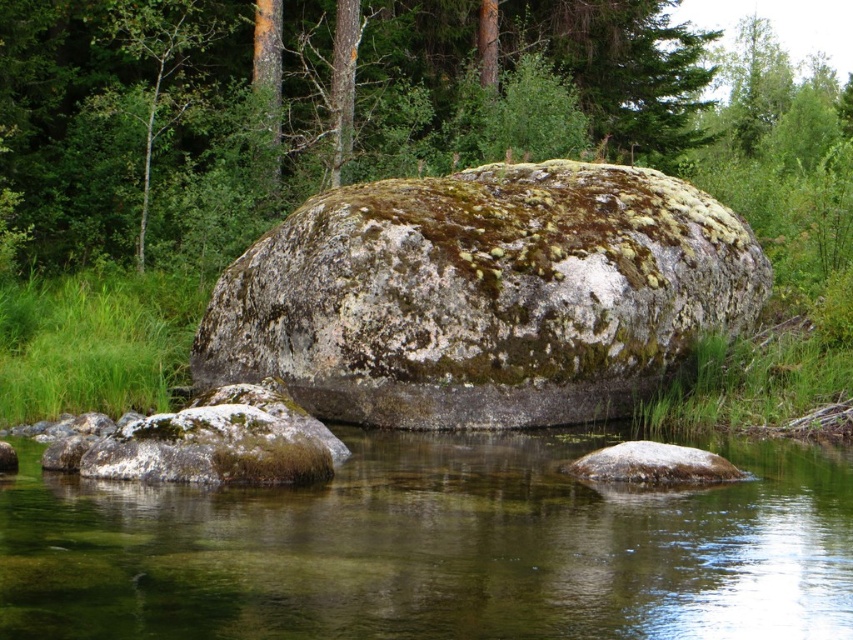
Based on the photo, you are standing at the edge of the water and see the clear water at center and the smooth gray rock at center. Which one is lower in height?

The clear water at center has a lesser height compared to the smooth gray rock at center, so the clear water at center is lower in height.

Based on the photo, you are standing at the edge of the water and see the clear water at center and the green mossy rock at center. Which object is directly above the other?

The green mossy rock at center is directly above the clear water at center because the clear water at center is positioned under it.

You are standing at the edge of the water and want to place a small statue on the closest green mossy rock. Which rock should you choose between the green mossy rock at center and the green mossy rock at lower left?

The green mossy rock at lower left is closer to you, so you should place the statue there.